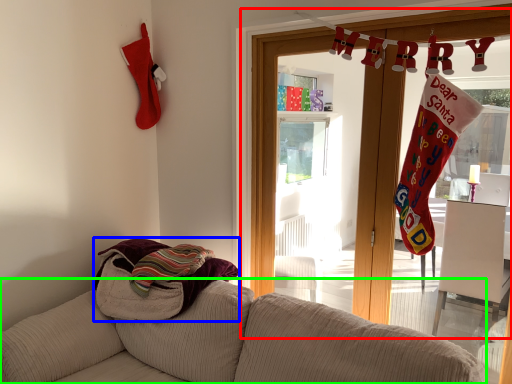
Question: Estimate the real-world distances between objects in this image. Which object is closer to window frame (highlighted by a red box), beach towel (highlighted by a blue box) or studio couch (highlighted by a green box)?

Choices:
 (A) beach towel
 (B) studio couch

Answer: (A)